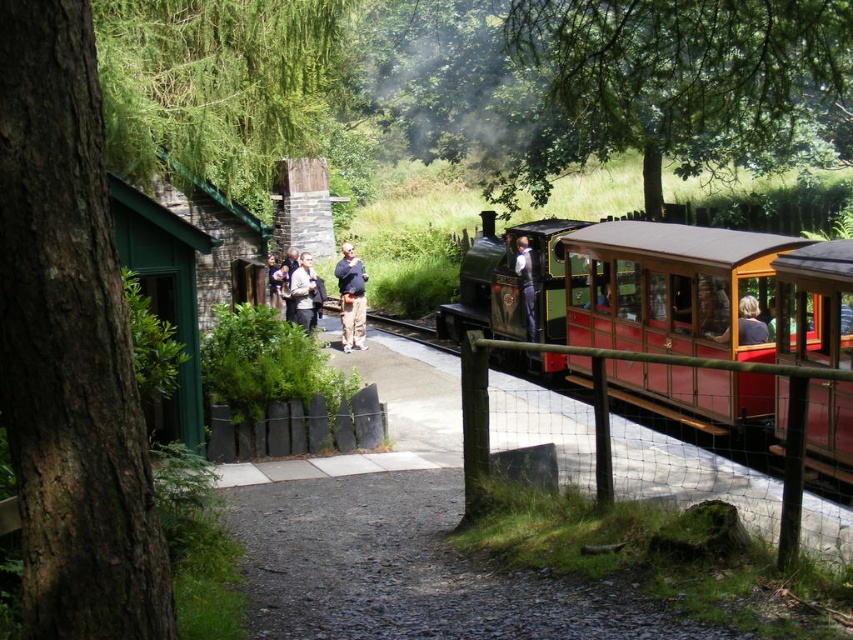
You are a photographer trying to capture a candid shot of the group near the station. Since you want to focus on the light brown leather jacket at center and the matte brown hair at right, which one should you zoom in on to ensure it takes up more space in your photo?

The light brown leather jacket at center is bigger than the matte brown hair at right, so you should zoom in on the light brown leather jacket at center to ensure it takes up more space in your photo.

You are a photographer trying to capture a candid shot of the two people at the center of the scene. You want to ensure that both the dark blue jeans at center and the light brown leather jacket at center are clearly visible in the frame. Based on their sizes, which clothing item should you focus on to ensure it fits within the camera frame first?

The dark blue jeans at center is narrower than the light brown leather jacket at center, so you should focus on ensuring the light brown leather jacket at center fits first since it is wider.